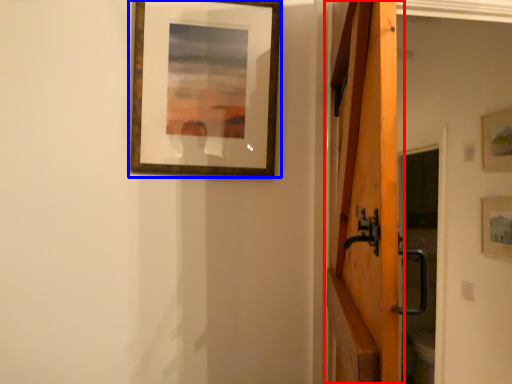
Question: Among these objects, which one is nearest to the camera, barn door (highlighted by a red box) or picture frame (highlighted by a blue box)?

Choices:
 (A) barn door
 (B) picture frame

Answer: (A)